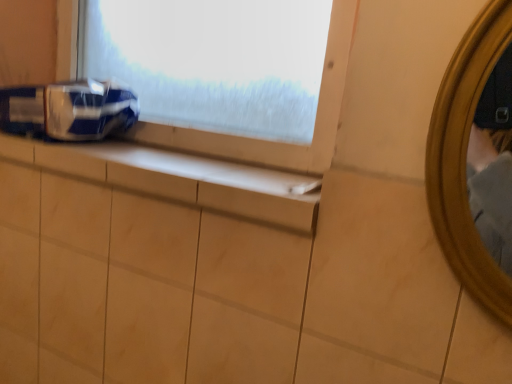
In order to face white tile at lower center, should I rotate leftwards or rightwards?

Turn left by 16.223 degrees to look at white tile at lower center.

The image size is (512, 384). What do you see at coordinates (177, 178) in the screenshot?
I see `white tile at lower center` at bounding box center [177, 178].

This screenshot has height=384, width=512. I want to click on white tile at lower center, so click(x=177, y=178).

Locate an element on the screen. This screenshot has height=384, width=512. white tile at lower center is located at coordinates (177, 178).